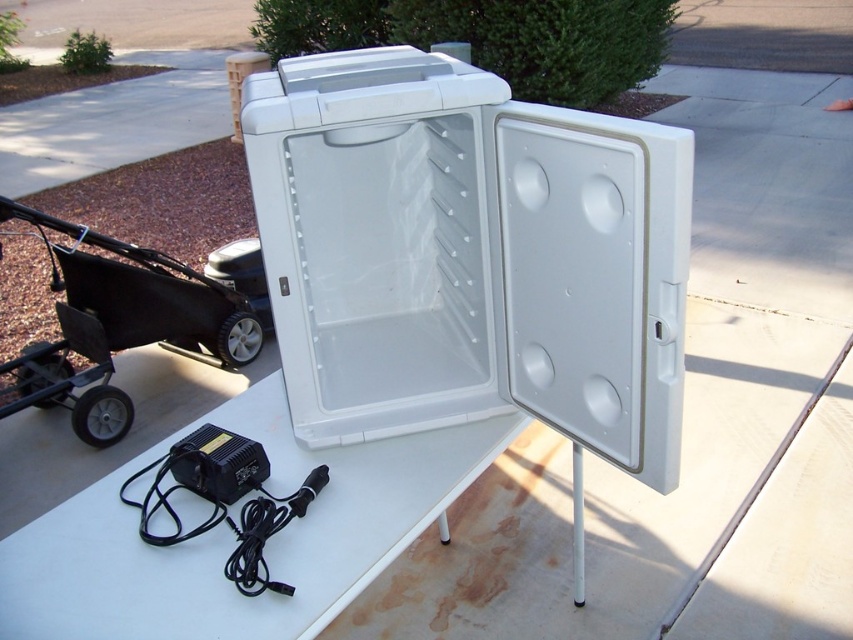
You are setting up a picnic and need to place the white plastic cooler at center and the white plastic table at center on the concrete surface. According to the scene, which object is positioned to the right of the other?

The white plastic cooler at center is to the right of the white plastic table at center.

You are setting up a picnic and need to place a rectangular box between the white plastic cooler at center and the white plastic table at center. Which object should the box be closer to if it needs to be placed closer to the thinner one?

The white plastic cooler at center is thinner than the white plastic table at center, so the box should be placed closer to the white plastic cooler at center.

You are setting up a picnic and need to place a white plastic table at center. According to the image, where exactly should you position it?

The white plastic table at center should be positioned at point (233, 540).